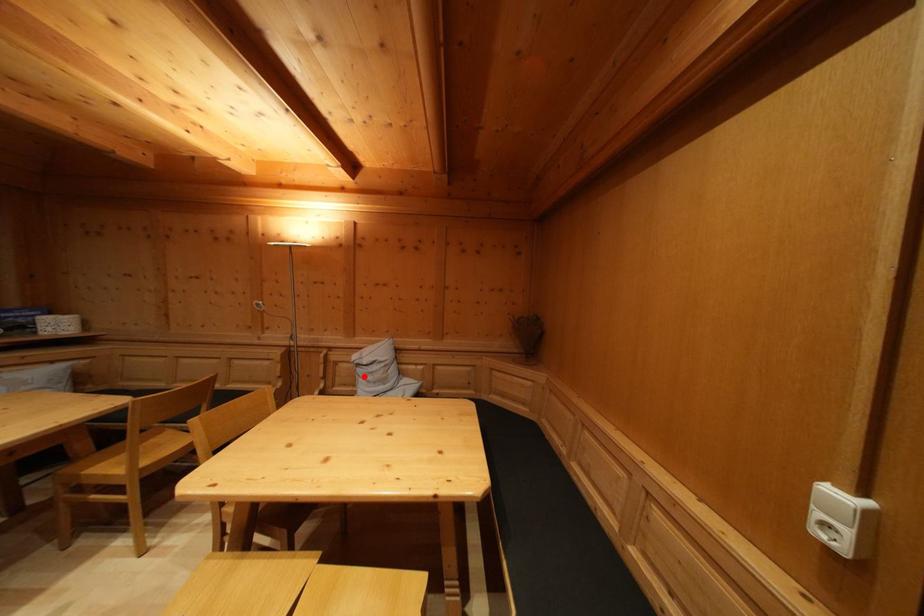
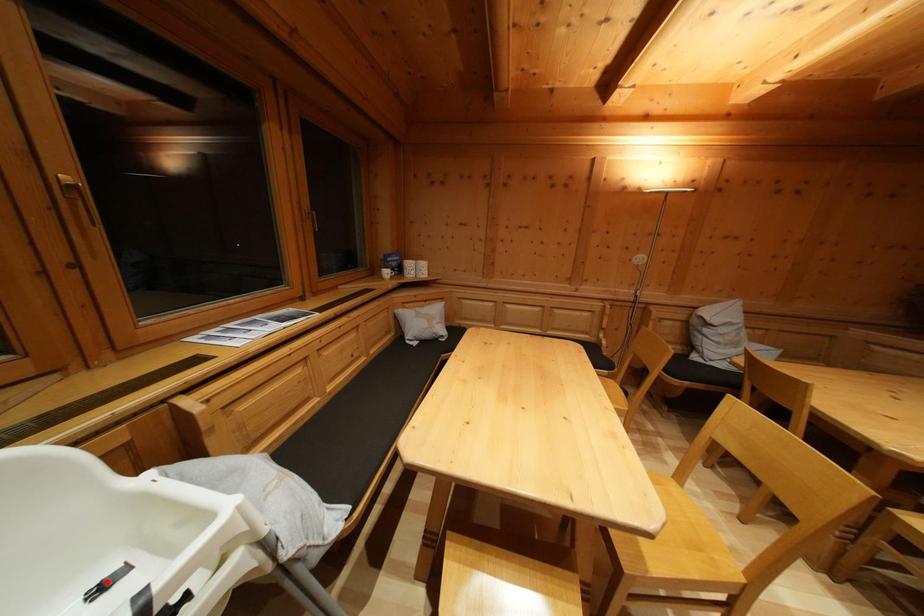
I am providing you with two images of the same scene from different viewpoints. A red point is marked on the first image and another point is marked on the second image. Are the points marked in image1 and image2 representing the same 3D position?

No